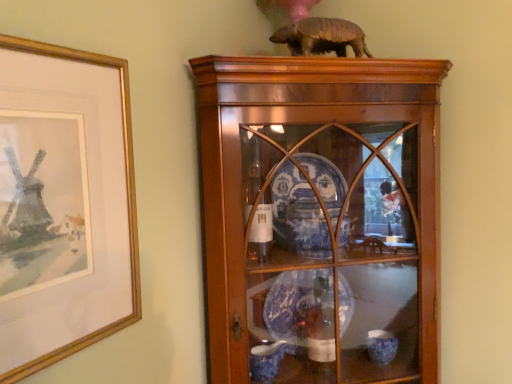
Question: Is gold-framed picture at left not close to wooden cabinet at center?

Choices:
 (A) no
 (B) yes

Answer: (A)

Question: Could you tell me if gold-framed picture at left is turned towards wooden cabinet at center?

Choices:
 (A) yes
 (B) no

Answer: (B)

Question: From a real-world perspective, does gold-framed picture at left sit lower than wooden cabinet at center?

Choices:
 (A) no
 (B) yes

Answer: (A)

Question: Can you confirm if gold-framed picture at left is bigger than wooden cabinet at center?

Choices:
 (A) no
 (B) yes

Answer: (A)

Question: Is gold-framed picture at left turned away from wooden cabinet at center?

Choices:
 (A) yes
 (B) no

Answer: (B)

Question: Does gold-framed picture at left lie behind wooden cabinet at center?

Choices:
 (A) no
 (B) yes

Answer: (A)

Question: From a real-world perspective, is brown matte armadillo at upper center on top of wooden cabinet at center?

Choices:
 (A) yes
 (B) no

Answer: (A)

Question: Does brown matte armadillo at upper center turn towards wooden cabinet at center?

Choices:
 (A) yes
 (B) no

Answer: (B)

Question: Is brown matte armadillo at upper center taller than wooden cabinet at center?

Choices:
 (A) yes
 (B) no

Answer: (B)

Question: Are brown matte armadillo at upper center and wooden cabinet at center beside each other?

Choices:
 (A) yes
 (B) no

Answer: (B)

Question: Is brown matte armadillo at upper center at the right side of wooden cabinet at center?

Choices:
 (A) no
 (B) yes

Answer: (A)

Question: Is brown matte armadillo at upper center smaller than wooden cabinet at center?

Choices:
 (A) no
 (B) yes

Answer: (B)

Question: Does brown matte armadillo at upper center have a lesser height compared to gold-framed picture at left?

Choices:
 (A) no
 (B) yes

Answer: (B)